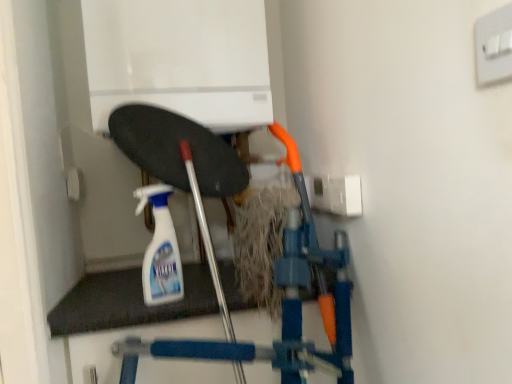
Image resolution: width=512 pixels, height=384 pixels. Find the location of `vacant space behind clear plastic spray bottle at center`. vacant space behind clear plastic spray bottle at center is located at coordinates (183, 282).